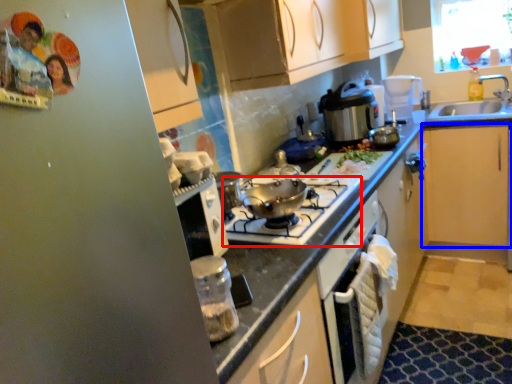
Question: Which point is closer to the camera, gas stove (highlighted by a red box) or cabinetry (highlighted by a blue box)?

Choices:
 (A) gas stove
 (B) cabinetry

Answer: (A)